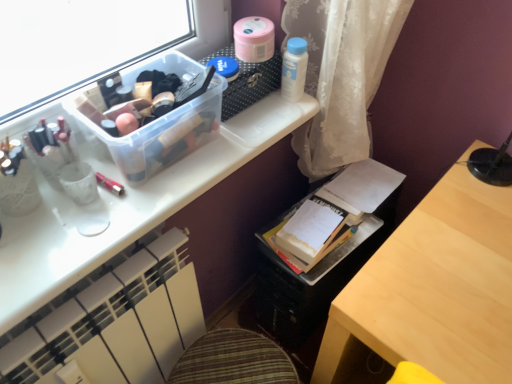
Question: Does point (309, 269) appear closer or farther from the camera than point (295, 39)?

Choices:
 (A) farther
 (B) closer

Answer: (A)

Question: Looking at the image, does white paper book at center seem bigger or smaller compared to white plastic bottle at upper right, acting as the 2th toiletry starting from the front?

Choices:
 (A) small
 (B) big

Answer: (B)

Question: Which object is the farthest from the matte white desk at upper center?

Choices:
 (A) white paper book at center
 (B) metallic pink pen at upper left, which is counted as the 2th toiletry, starting from the back
 (C) white plastic bottle at upper right, the 2th toiletry when ordered from left to right

Answer: (C)

Question: Which is farther from the metallic pink pen at upper left, the 1th toiletry in the left-to-right sequence?

Choices:
 (A) matte white desk at upper center
 (B) white paper book at center
 (C) white plastic bottle at upper right, which is the first toiletry in back-to-front order

Answer: (B)